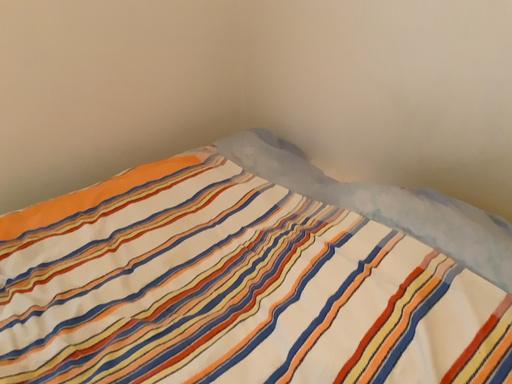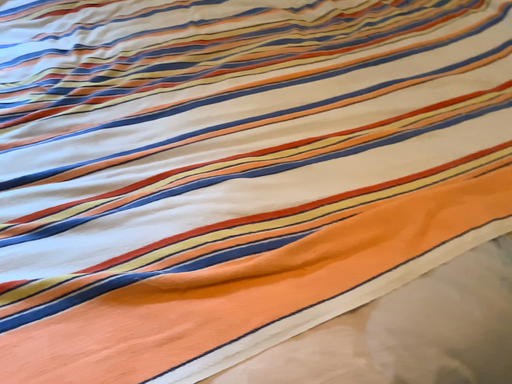
Question: How did the camera likely rotate when shooting the video?

Choices:
 (A) rotated right
 (B) rotated left

Answer: (B)